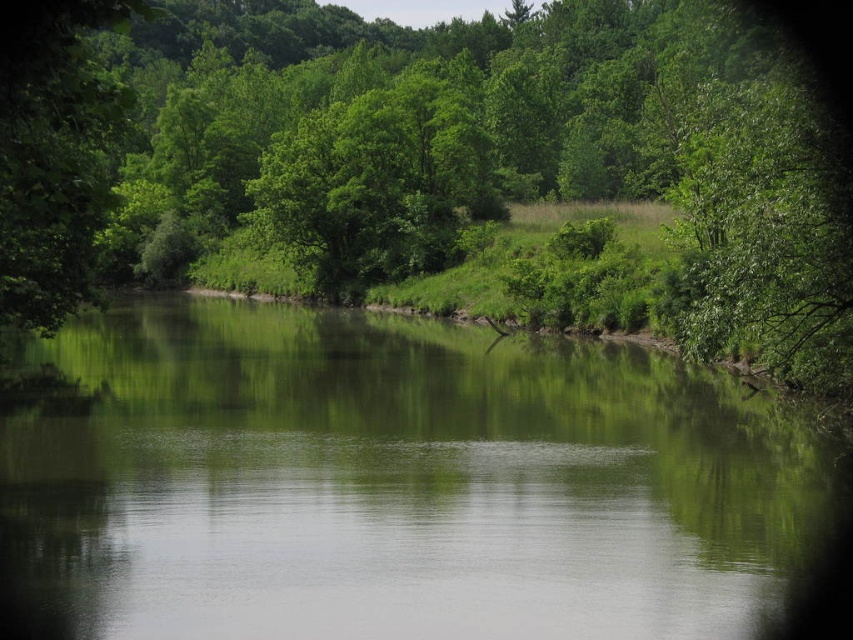
Is point (639, 387) closer to camera compared to point (102, 200)?

That is False.

Does green reflective water at center appear on the right side of green leafy tree at left?

Correct, you'll find green reflective water at center to the right of green leafy tree at left.

Who is more forward, (416, 516) or (117, 100)?

Point (117, 100) is more forward.

Locate an element on the screen. This screenshot has height=640, width=853. green reflective water at center is located at coordinates (393, 484).

Describe the element at coordinates (453, 160) in the screenshot. The image size is (853, 640). I see `green leafy tree at center` at that location.

Does green leafy tree at center have a smaller size compared to green leafy tree at left?

No.

Locate an element on the screen. The width and height of the screenshot is (853, 640). green leafy tree at center is located at coordinates (453, 160).

Locate an element on the screen. The width and height of the screenshot is (853, 640). green reflective water at center is located at coordinates (393, 484).

Can you confirm if green reflective water at center is positioned to the left of green leafy tree at center?

Incorrect, green reflective water at center is not on the left side of green leafy tree at center.

Between point (26, 499) and point (309, 99), which one is positioned in front?

Point (26, 499) is more forward.

Image resolution: width=853 pixels, height=640 pixels. Find the location of `green reflective water at center`. green reflective water at center is located at coordinates (393, 484).